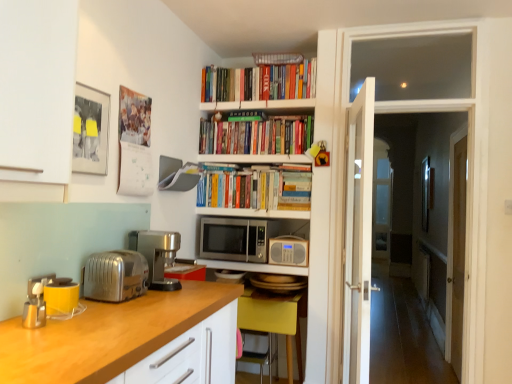
This screenshot has height=384, width=512. What do you see at coordinates (38, 285) in the screenshot?
I see `metallic silver toaster at left, which is counted as the third appliance, starting from the back` at bounding box center [38, 285].

Image resolution: width=512 pixels, height=384 pixels. I want to click on white wooden door at center, so click(358, 237).

What is the approximate width of satin silver toaster at lower left?

10.24 inches.

The height and width of the screenshot is (384, 512). I want to click on hardcover books at center, which is the 3th book in top-to-bottom order, so click(x=255, y=188).

Who is bigger, satin silver coffee machine at left or hardcover books at upper center, which ranks as the third book in bottom-to-top order?

Bigger between the two is hardcover books at upper center, which ranks as the third book in bottom-to-top order.

Visually, is satin silver coffee machine at left positioned to the left or to the right of hardcover books at upper center, which ranks as the first book in top-to-bottom order?

From the image, it's evident that satin silver coffee machine at left is to the left of hardcover books at upper center, which ranks as the first book in top-to-bottom order.

Measure the distance from satin silver coffee machine at left to hardcover books at upper center, which ranks as the third book in bottom-to-top order.

1.41 meters.

Are satin silver coffee machine at left and hardcover books at upper center, which ranks as the first book in top-to-bottom order, far apart?

That's right, there is a large distance between satin silver coffee machine at left and hardcover books at upper center, which ranks as the first book in top-to-bottom order.

Considering the relative positions of metallic microwave at center, acting as the first appliance starting from the back, and metallic silver toaster at left, which is counted as the third appliance, starting from the back, in the image provided, is metallic microwave at center, acting as the first appliance starting from the back, to the left or to the right of metallic silver toaster at left, which is counted as the third appliance, starting from the back,?

Clearly, metallic microwave at center, acting as the first appliance starting from the back, is on the right of metallic silver toaster at left, which is counted as the third appliance, starting from the back, in the image.

Considering the relative sizes of metallic microwave at center, which appears as the 3th appliance when viewed from the left, and metallic silver toaster at left, placed as the 4th appliance when sorted from right to left, in the image provided, is metallic microwave at center, which appears as the 3th appliance when viewed from the left, thinner than metallic silver toaster at left, placed as the 4th appliance when sorted from right to left,?

In fact, metallic microwave at center, which appears as the 3th appliance when viewed from the left, might be wider than metallic silver toaster at left, placed as the 4th appliance when sorted from right to left.

Consider the image. Can you tell me how much metallic microwave at center, acting as the first appliance starting from the back, and metallic silver toaster at left, marked as the 2th appliance in a front-to-back arrangement, differ in facing direction?

The angle between the facing direction of metallic microwave at center, acting as the first appliance starting from the back, and the facing direction of metallic silver toaster at left, marked as the 2th appliance in a front-to-back arrangement, is 84.4 degrees.

Based on their sizes in the image, would you say metallic microwave at center, the fourth appliance positioned from the front, is bigger or smaller than metallic silver toaster at left, marked as the 2th appliance in a front-to-back arrangement?

Clearly, metallic microwave at center, the fourth appliance positioned from the front, is larger in size than metallic silver toaster at left, marked as the 2th appliance in a front-to-back arrangement.

Which is behind, point (261, 138) or point (462, 143)?

The point (462, 143) is farther.

From a real-world perspective, is hardcover books at upper center, which is the second book in bottom-to-top order, located higher than transparent glass door at right?

Yes, from a real-world perspective, hardcover books at upper center, which is the second book in bottom-to-top order, is above transparent glass door at right.

Can you confirm if hardcover books at upper center, which is the second book in bottom-to-top order, is thinner than transparent glass door at right?

Incorrect, the width of hardcover books at upper center, which is the second book in bottom-to-top order, is not less than that of transparent glass door at right.

Which object is further away from the camera taking this photo, hardcover books at upper center, which is the second book in bottom-to-top order, or transparent glass door at right?

transparent glass door at right is further from the camera.

How much distance is there between hardcover books at upper center, which ranks as the third book in bottom-to-top order, and wooden countertop at lower left?

5.83 feet.

From the image's perspective, which one is positioned higher, hardcover books at upper center, which ranks as the third book in bottom-to-top order, or wooden countertop at lower left?

hardcover books at upper center, which ranks as the third book in bottom-to-top order, from the image's perspective.

Does hardcover books at upper center, which ranks as the first book in top-to-bottom order, appear on the left side of wooden countertop at lower left?

No.

Does hardcover books at upper center, which ranks as the first book in top-to-bottom order, come in front of wooden countertop at lower left?

No, the depth of hardcover books at upper center, which ranks as the first book in top-to-bottom order, is greater than that of wooden countertop at lower left.

Is satin silver coffee machine at left oriented towards transparent glass door at right?

No, satin silver coffee machine at left is not oriented towards transparent glass door at right.

Which of these two, satin silver coffee machine at left or transparent glass door at right, is wider?

satin silver coffee machine at left is wider.

How different are the orientations of satin silver coffee machine at left and transparent glass door at right in degrees?

They differ by 180 degrees in their facing directions.

Where is `coffee machine above the transparent glass door at right (from the image's perspective)`? coffee machine above the transparent glass door at right (from the image's perspective) is located at coordinates (157, 255).

Choose the correct answer: Is stainless steel microwave at center inside metallic yellow toaster at left, the 2th appliance from the left, or outside it?

stainless steel microwave at center is located beyond the bounds of metallic yellow toaster at left, the 2th appliance from the left.

From a real-world perspective, is stainless steel microwave at center positioned under metallic yellow toaster at left, which is the fourth appliance in back-to-front order, based on gravity?

No.

Considering the sizes of objects stainless steel microwave at center and metallic yellow toaster at left, which is the fourth appliance in back-to-front order, in the image provided, who is thinner, stainless steel microwave at center or metallic yellow toaster at left, which is the fourth appliance in back-to-front order,?

Thinner between the two is metallic yellow toaster at left, which is the fourth appliance in back-to-front order.

Locate an element on the screen. This screenshot has height=384, width=512. microwave oven that appears on the right of metallic yellow toaster at left, which is the fourth appliance in back-to-front order is located at coordinates (234, 239).

Looking at this image, is satin silver coffee machine at left in front of or behind white wooden door at center in the image?

In the image, satin silver coffee machine at left appears behind white wooden door at center.

Could you tell me if satin silver coffee machine at left is facing white wooden door at center?

No, satin silver coffee machine at left does not turn towards white wooden door at center.

Considering the relative sizes of satin silver coffee machine at left and white wooden door at center in the image provided, is satin silver coffee machine at left shorter than white wooden door at center?

Correct, satin silver coffee machine at left is not as tall as white wooden door at center.

From a real-world perspective, which book is the 3rd one above the satin silver coffee machine at left? Please provide its 2D coordinates.

[(259, 82)]

From the metallic microwave at center, which appears as the 3th appliance when viewed from the left, count 2nd appliances forward and point to it. Please provide its 2D coordinates.

[(38, 285)]

Considering their positions, is metallic silver toaster at left, which is the 1th appliance in left-to-right order, positioned closer to metallic microwave at center, which appears as the 3th appliance when viewed from the left, than stainless steel microwave at center?

stainless steel microwave at center is closer to metallic microwave at center, which appears as the 3th appliance when viewed from the left.

From the image, which object appears to be farther from metallic yellow toaster at left, which is the 3th appliance from right to left, white wooden door at center or hardcover books at upper center, which ranks as the second book in top-to-bottom order?

The object further to metallic yellow toaster at left, which is the 3th appliance from right to left, is hardcover books at upper center, which ranks as the second book in top-to-bottom order.

Which object lies nearer to the anchor point metallic yellow toaster at left, which is the 3th appliance from right to left, hardcover books at center, the first book positioned from the bottom, or wooden radio at center, marked as the third appliance in a front-to-back arrangement?

wooden radio at center, marked as the third appliance in a front-to-back arrangement, lies closer to metallic yellow toaster at left, which is the 3th appliance from right to left, than the other object.

Looking at the image, which one is located further to hardcover books at upper center, which ranks as the second book in top-to-bottom order, metallic silver toaster at left, which is counted as the third appliance, starting from the back, or white wooden door at center?

Among the two, metallic silver toaster at left, which is counted as the third appliance, starting from the back, is located further to hardcover books at upper center, which ranks as the second book in top-to-bottom order.

Estimate the real-world distances between objects in this image. Which object is further from hardcover books at center, the first book positioned from the bottom, metallic yellow toaster at left, which is the 3th appliance from right to left, or transparent glass door at right?

metallic yellow toaster at left, which is the 3th appliance from right to left, is further to hardcover books at center, the first book positioned from the bottom.

From the picture: Which object lies further to the anchor point wooden bookshelf at center, wooden radio at center, placed as the 1th appliance when sorted from right to left, or metallic microwave at center, which appears as the 3th appliance when viewed from the left?

metallic microwave at center, which appears as the 3th appliance when viewed from the left.

When comparing their distances from transparent glass door at right, does stainless steel microwave at center or metallic yellow toaster at left, the 2th appliance from the left, seem further?

Based on the image, metallic yellow toaster at left, the 2th appliance from the left, appears to be further to transparent glass door at right.

When comparing their distances from hardcover books at upper center, which is the second book in bottom-to-top order, does wooden countertop at lower left or stainless steel microwave at center seem further?

wooden countertop at lower left is positioned further to the anchor hardcover books at upper center, which is the second book in bottom-to-top order.

Locate an element on the screen. The image size is (512, 384). appliance located between stainless steel microwave at center and transparent glass door at right in the left-right direction is located at coordinates (288, 251).

At what (x,y) coordinates should I click in order to perform the action: click on coffee machine between metallic yellow toaster at left, the 1th appliance viewed from the front, and stainless steel microwave at center in the front-back direction. Please return your answer as a coordinate pair (x, y). This screenshot has height=384, width=512. Looking at the image, I should click on (157, 255).

Identify the location of appliance between wooden radio at center, marked as the third appliance in a front-to-back arrangement, and yellow matte computer desk at center vertically. (229, 276).

You are a GUI agent. You are given a task and a screenshot of the screen. Output one action in this format:
    pyautogui.click(x=<x>, y=<y>)
    Task: Click on the door between hardcover books at upper center, which ranks as the first book in top-to-bottom order, and yellow matte computer desk at center, in the vertical direction
    
    Given the screenshot: What is the action you would take?
    pyautogui.click(x=358, y=237)